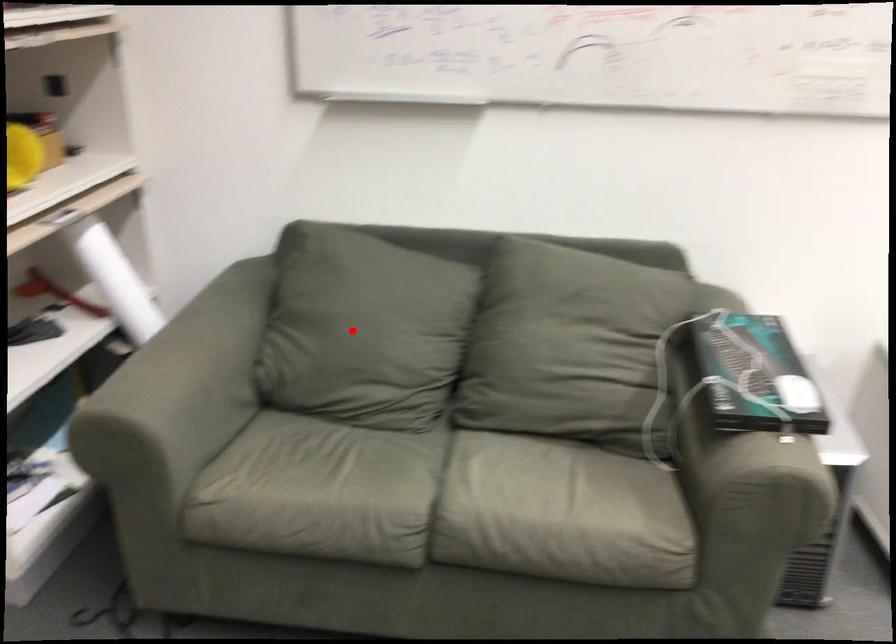
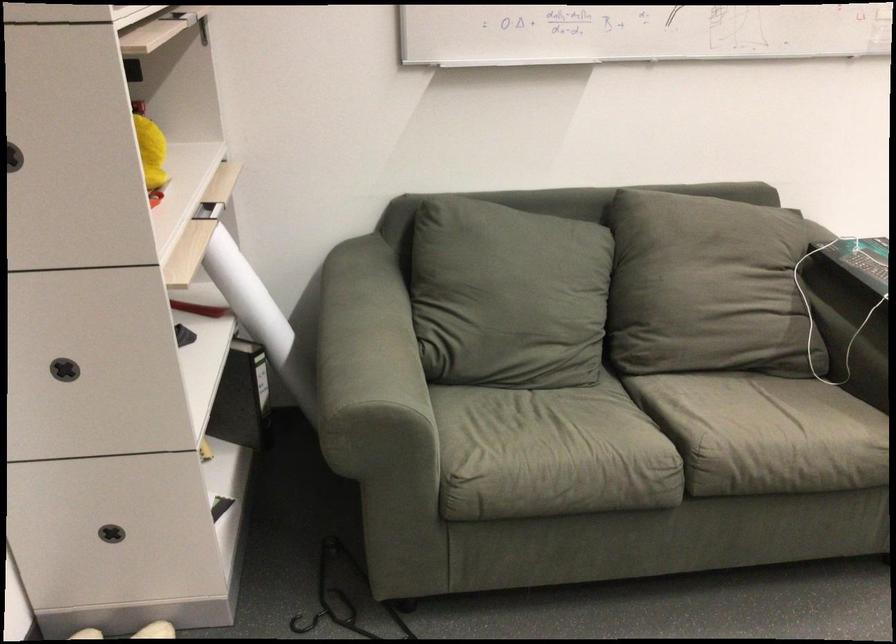
The point at the highlighted location is marked in the first image. Where is the corresponding point in the second image?

(506, 295)